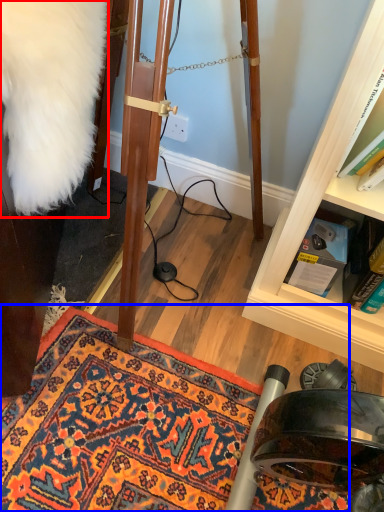
Question: Which point is further to the camera, fur coat (highlighted by a red box) or doormat (highlighted by a blue box)?

Choices:
 (A) fur coat
 (B) doormat

Answer: (B)